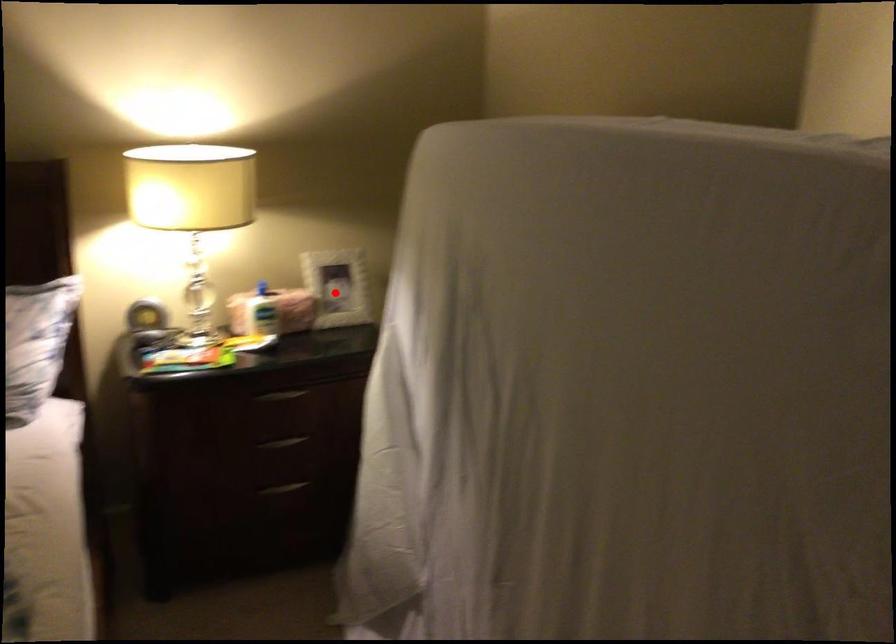
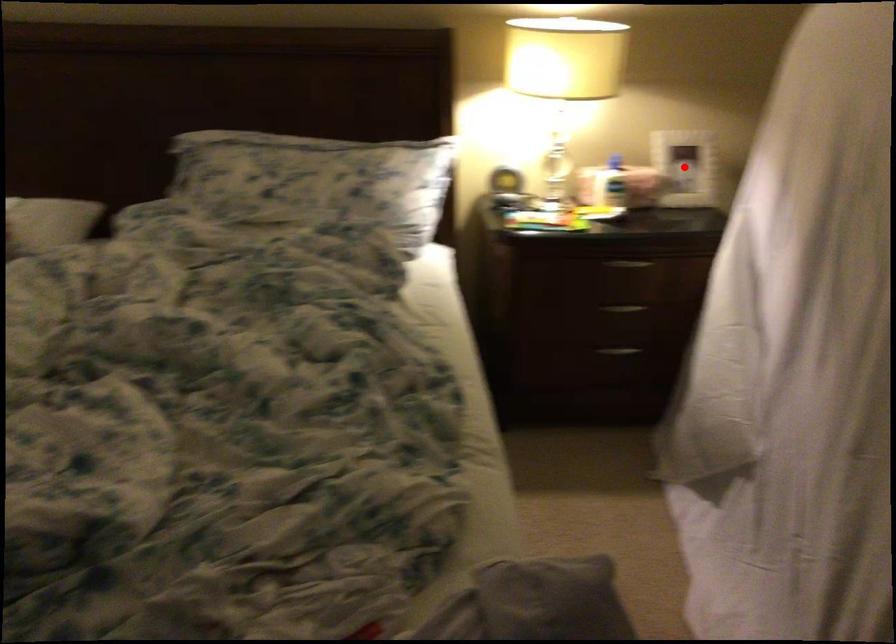
I am providing you with two images of the same scene from different viewpoints. A red point is marked on the first image and another point is marked on the second image. Is the marked point in image1 the same physical position as the marked point in image2?

Yes